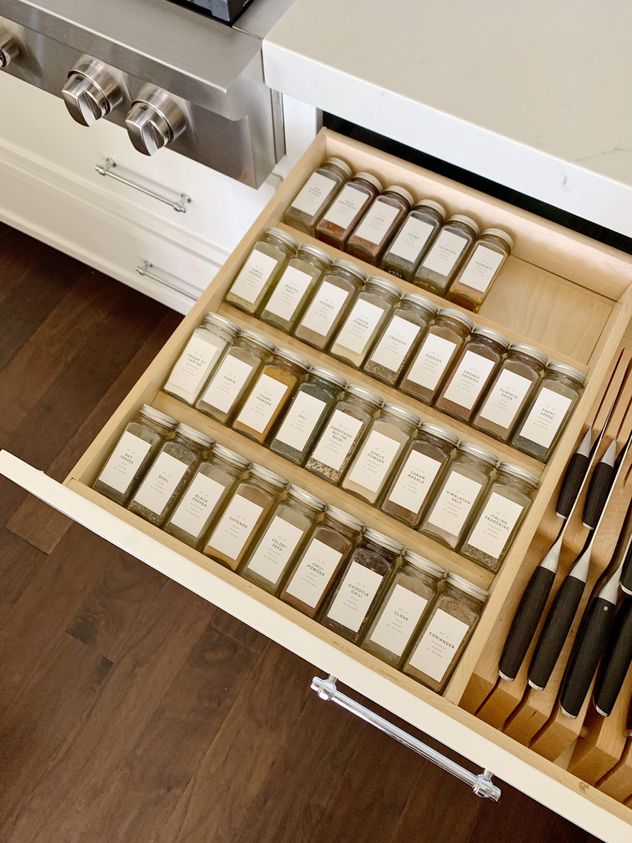
Find the location of a particular element. The height and width of the screenshot is (843, 632). knobs to turn on gas is located at coordinates (153, 110), (81, 121).